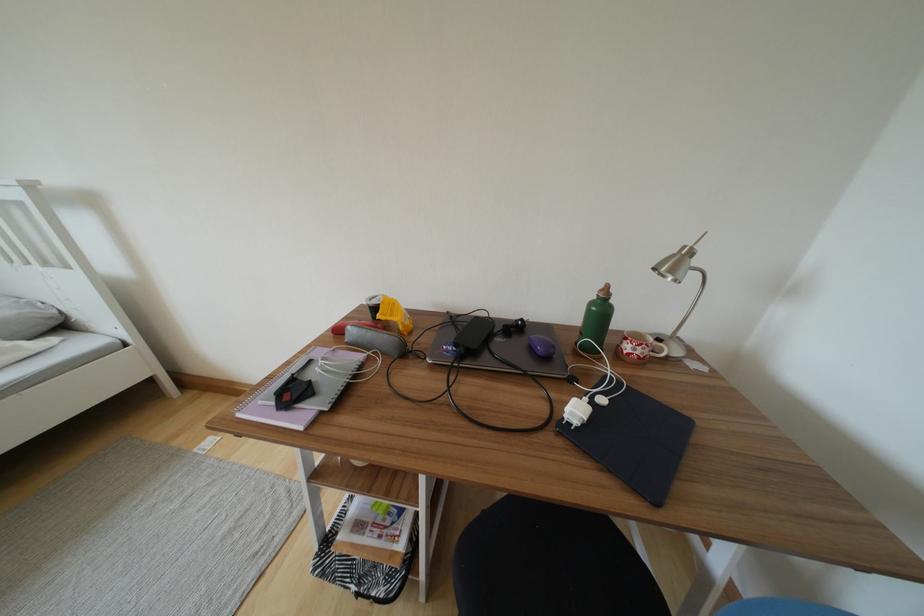
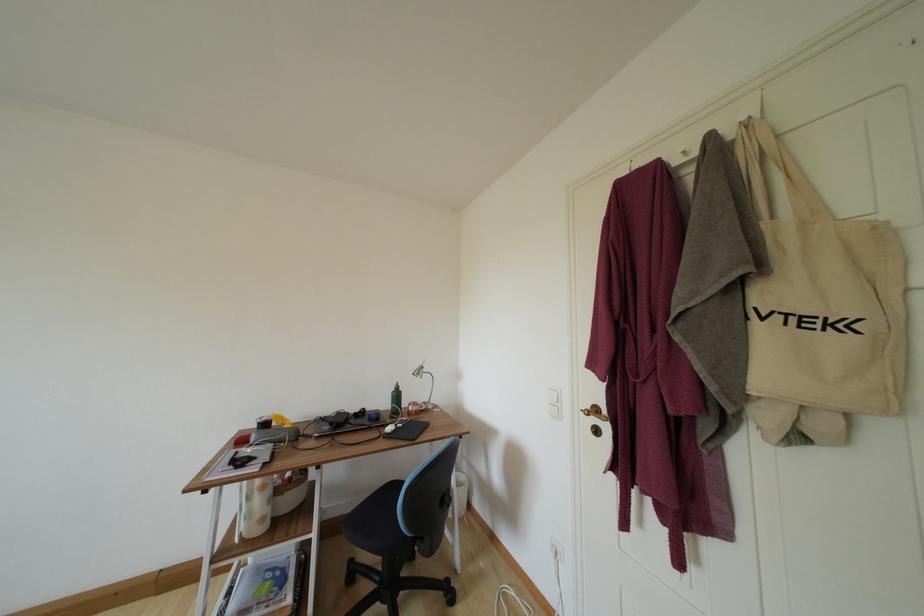
Find the pixel in the second image that matches point (523, 331) in the first image.

(367, 416)